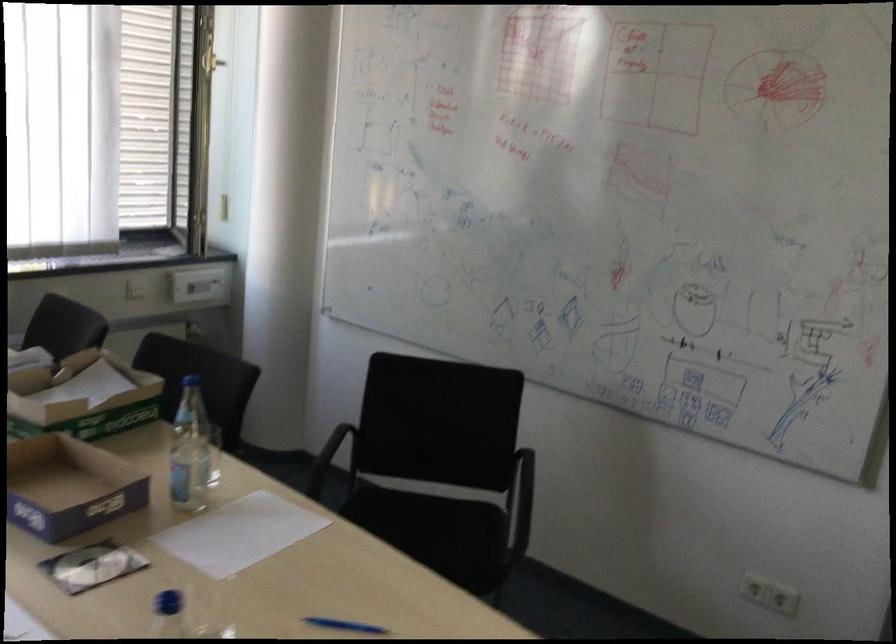
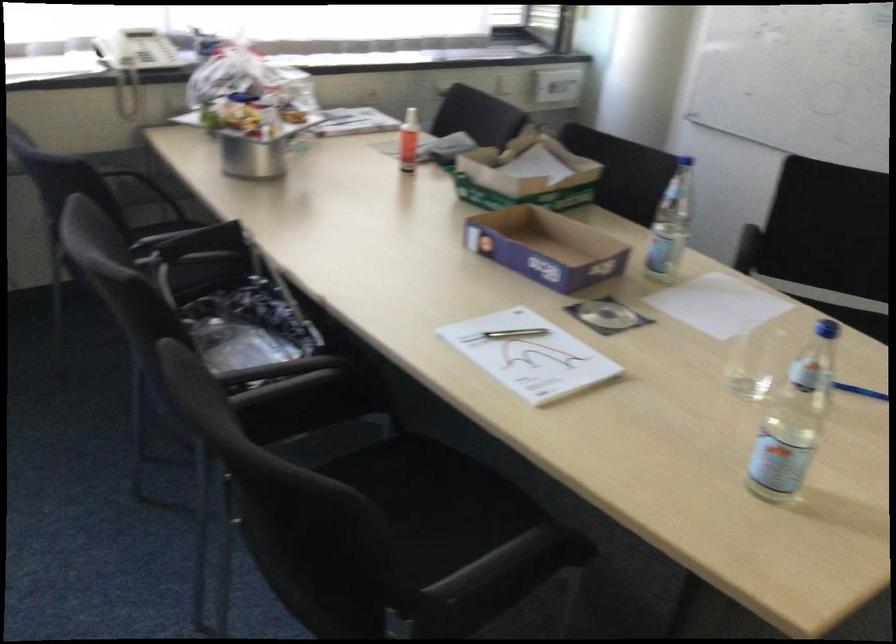
The point at (x=92, y=573) is marked in the first image. Where is the corresponding point in the second image?

(606, 315)